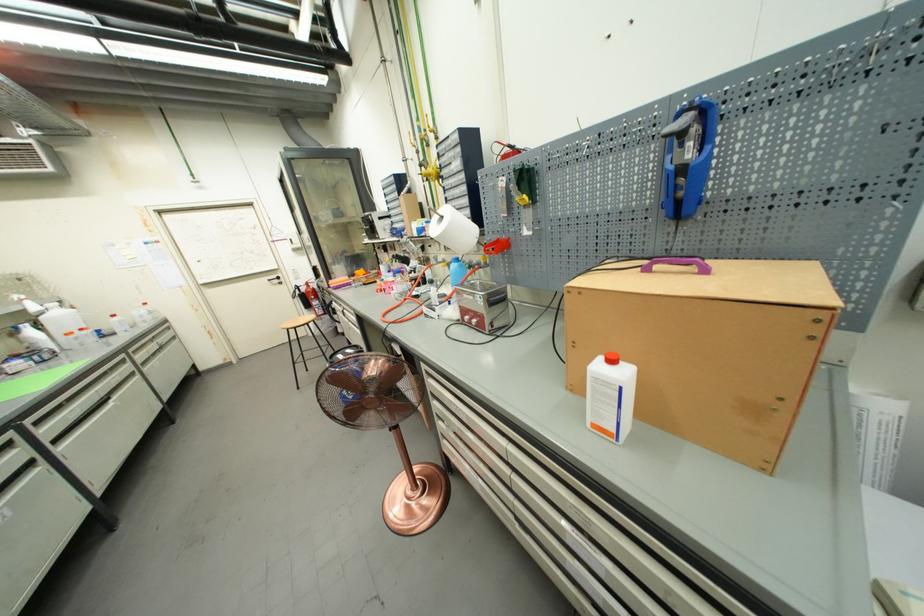
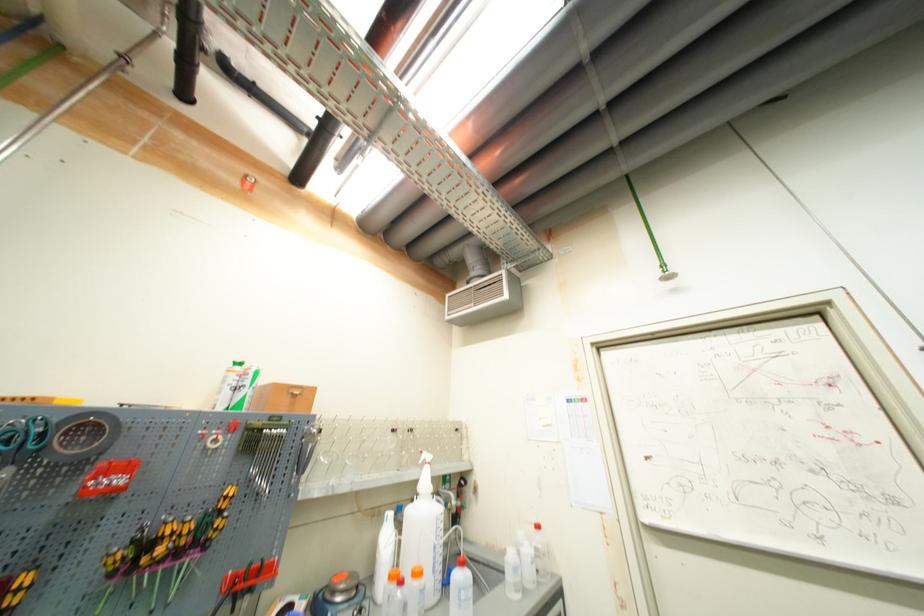
In the second image, find the point that corresponds to (30,312) in the first image.

(421, 484)